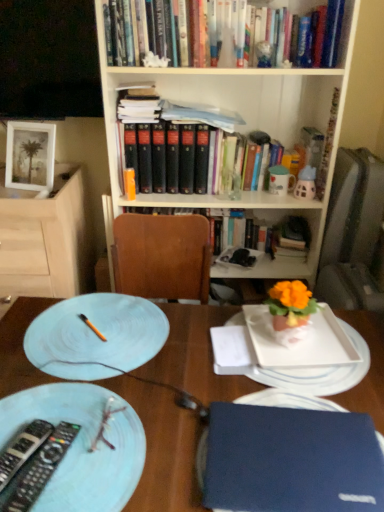
Image resolution: width=384 pixels, height=512 pixels. I want to click on vacant area that lies between blue hardcover book at lower right and light blue ceramic plate at center-left, which appears as the second plate when viewed from the front, so click(x=178, y=402).